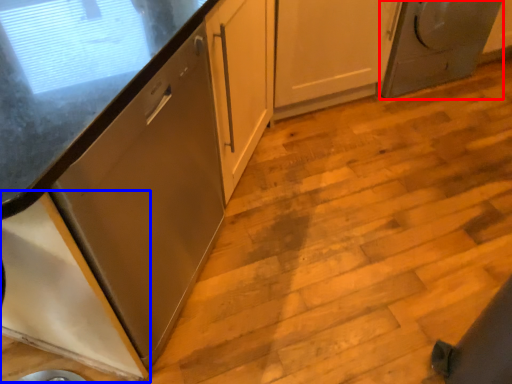
Question: Which of the following is the closest to the observer, home appliance (highlighted by a red box) or cabinetry (highlighted by a blue box)?

Choices:
 (A) home appliance
 (B) cabinetry

Answer: (B)